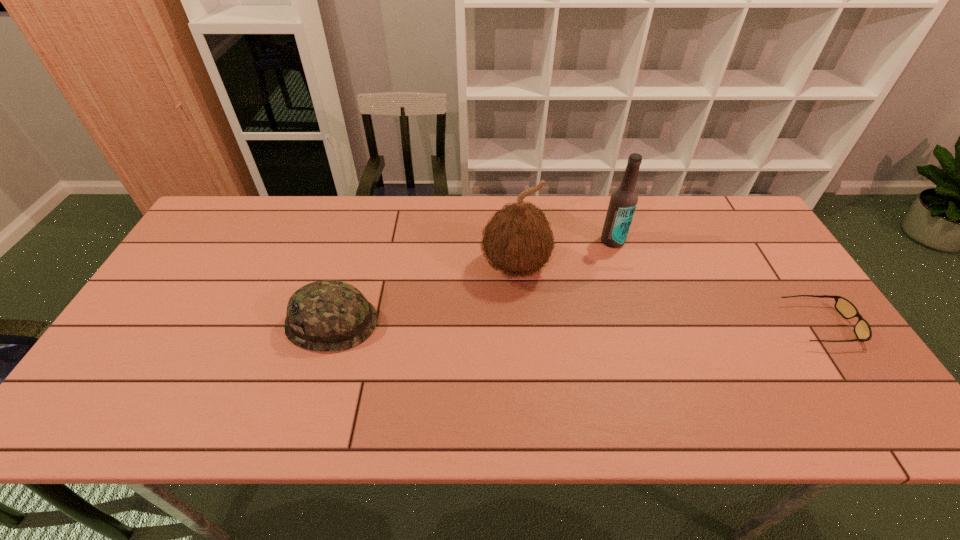
Point out which object is positioned as the second nearest to the third object from right to left. Please provide its 2D coordinates. Your answer should be formatted as a tuple, i.e. [(x, y)], where the tuple contains the x and y coordinates of a point satisfying the conditions above.

[(329, 315)]

Find the location of a particular element. The image size is (960, 540). object that stands as the third closest to the sunglasses is located at coordinates click(329, 315).

Image resolution: width=960 pixels, height=540 pixels. I want to click on vacant point that satisfies the following two spatial constraints: 1. on the front side of the third object from left to right; 2. on the front-facing side of the shortest object, so click(639, 325).

Locate an element on the screen. The width and height of the screenshot is (960, 540). vacant region that satisfies the following two spatial constraints: 1. on the back side of the third tallest object; 2. on the left side of the third object from left to right is located at coordinates (356, 241).

This screenshot has height=540, width=960. In order to click on free spot that satisfies the following two spatial constraints: 1. on the front side of the leftmost object; 2. on the front-facing side of the rightmost object in this screenshot , I will do `click(332, 325)`.

Find the location of a particular element. free space in the image that satisfies the following two spatial constraints: 1. on the front side of the sunglasses; 2. on the front-facing side of the second object from right to left is located at coordinates (639, 325).